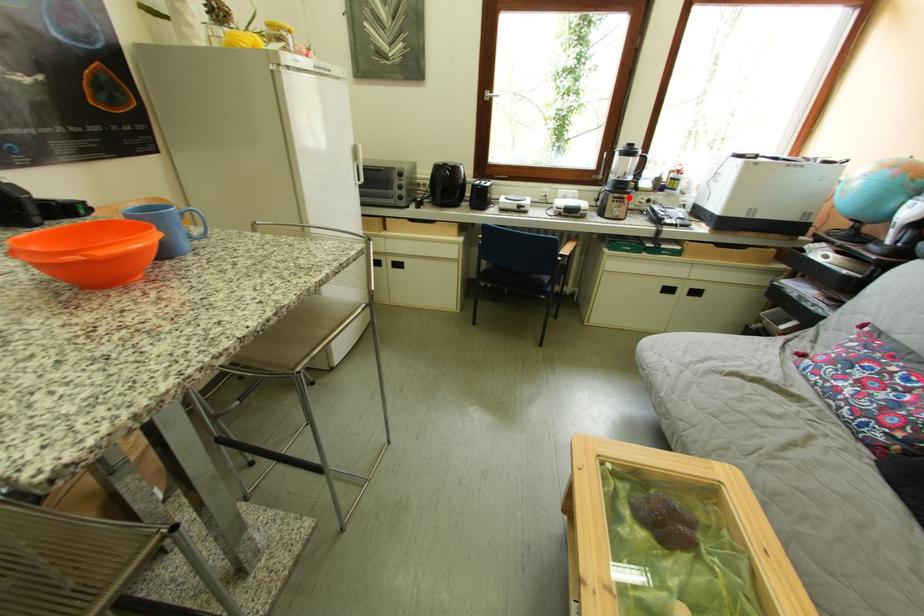
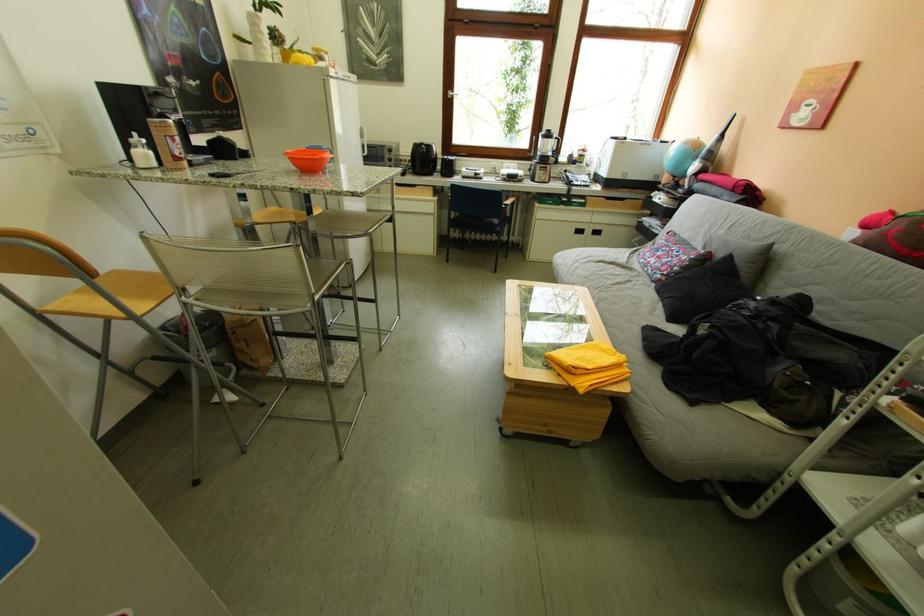
Question: I am providing you with two images of the same scene from different viewpoints. A red point is marked on the first image. Can you still see the location of the red point in image 2?

Choices:
 (A) Yes
 (B) No

Answer: (A)